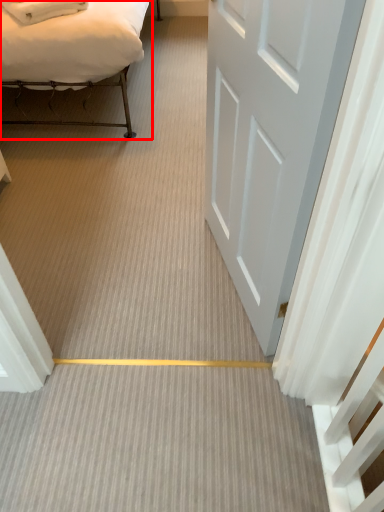
Question: From the image's perspective, where is bed (annotated by the red box) located in relation to door in the image?

Choices:
 (A) above
 (B) below

Answer: (A)